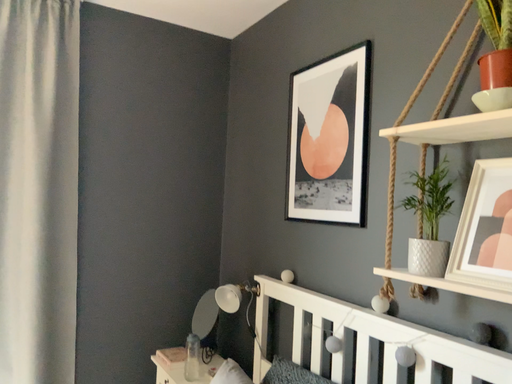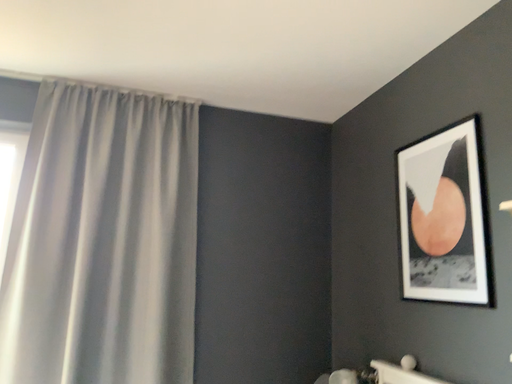
Question: How did the camera likely rotate when shooting the video?

Choices:
 (A) rotated right
 (B) rotated left

Answer: (B)